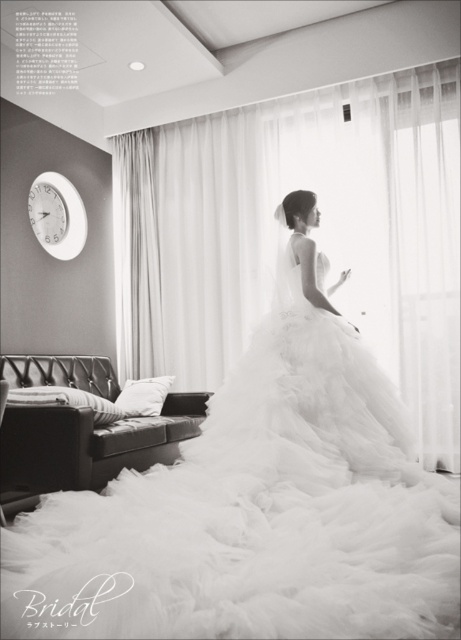
Can you confirm if white tulle dress at center is positioned to the right of white plastic clock at upper left?

Yes, white tulle dress at center is to the right of white plastic clock at upper left.

Is white tulle dress at center closer to the viewer compared to white plastic clock at upper left?

Yes, white tulle dress at center is in front of white plastic clock at upper left.

Image resolution: width=461 pixels, height=640 pixels. In order to click on white tulle dress at center in this screenshot , I will do point(259,502).